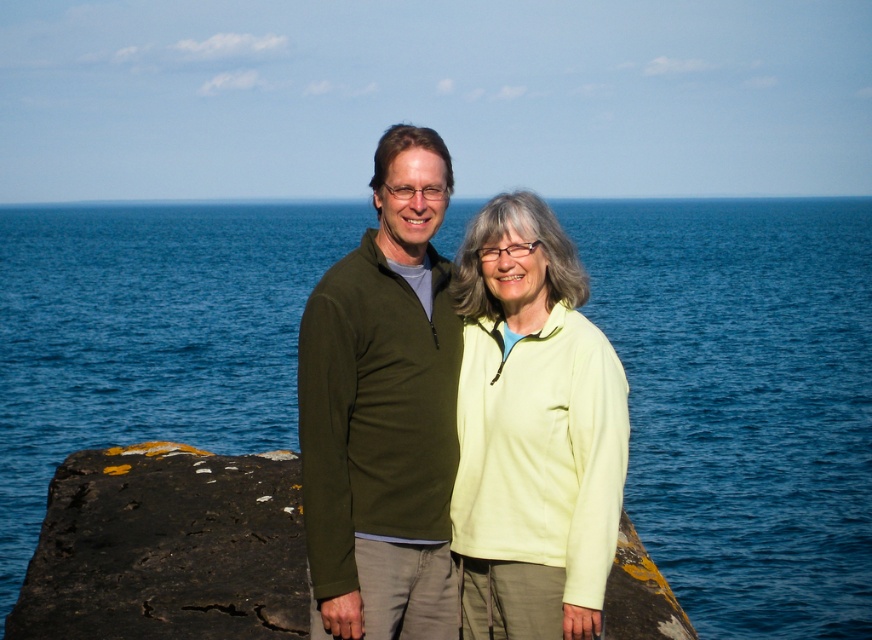
Question: Is olive green sweater at center smaller than black rough rock at center?

Choices:
 (A) yes
 (B) no

Answer: (B)

Question: Among these objects, which one is farthest from the camera?

Choices:
 (A) blue liquid water at center
 (B) black rough rock at center

Answer: (B)

Question: Is blue liquid water at center wider than light yellow fleece at center?

Choices:
 (A) no
 (B) yes

Answer: (B)

Question: Which object appears closest to the camera in this image?

Choices:
 (A) light yellow fleece at center
 (B) black rough rock at center
 (C) olive green sweater at center

Answer: (C)

Question: Considering the real-world distances, which object is closest to the olive green sweater at center?

Choices:
 (A) light yellow fleece at center
 (B) black rough rock at center

Answer: (B)

Question: Is blue liquid water at center positioned before black rough rock at center?

Choices:
 (A) yes
 (B) no

Answer: (A)